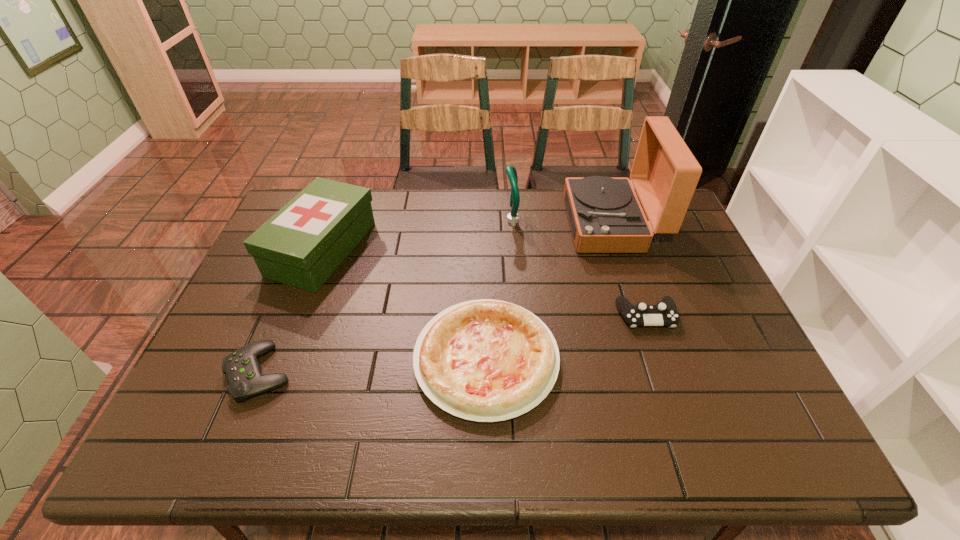
Where is `the tallest object`? The width and height of the screenshot is (960, 540). the tallest object is located at coordinates (605, 215).

Find the location of a particular element. the fifth shortest object is located at coordinates (510, 170).

Identify the location of the fourth shortest object. The height and width of the screenshot is (540, 960). (301, 245).

Locate an element on the screen. The width and height of the screenshot is (960, 540). pizza is located at coordinates (485, 360).

Where is `the right control`? the right control is located at coordinates (665, 313).

In order to click on the taller control in this screenshot , I will do `click(665, 313)`.

Image resolution: width=960 pixels, height=540 pixels. In order to click on the shortest object in this screenshot , I will do pyautogui.click(x=243, y=372).

Where is `the nearer control`? the nearer control is located at coordinates (243, 372).

Image resolution: width=960 pixels, height=540 pixels. In order to click on vacant space located on the face of the phonograph record in this screenshot , I will do `click(489, 224)`.

Image resolution: width=960 pixels, height=540 pixels. Identify the location of free space located on the face of the phonograph record. (483, 224).